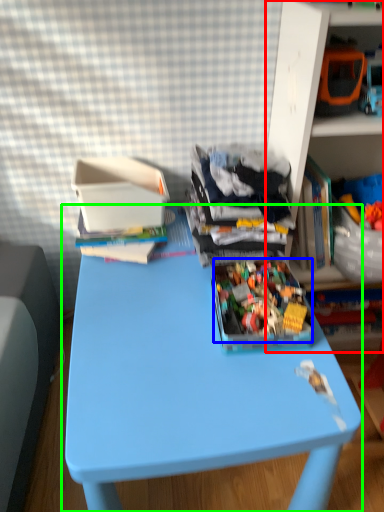
Question: Which is nearer to the shelf (highlighted by a red box)? toy (highlighted by a blue box) or table (highlighted by a green box).

Choices:
 (A) toy
 (B) table

Answer: (A)